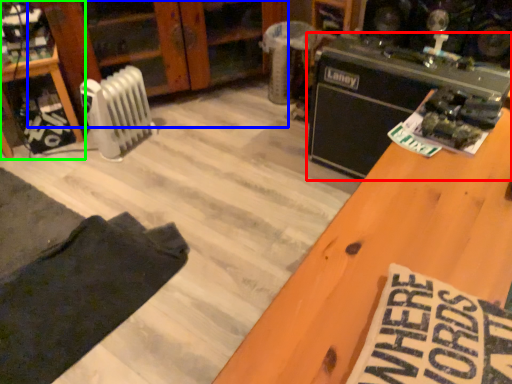
Question: Which is nearer to the appliance (highlighted by a red box)? dresser (highlighted by a blue box) or furniture (highlighted by a green box).

Choices:
 (A) dresser
 (B) furniture

Answer: (A)